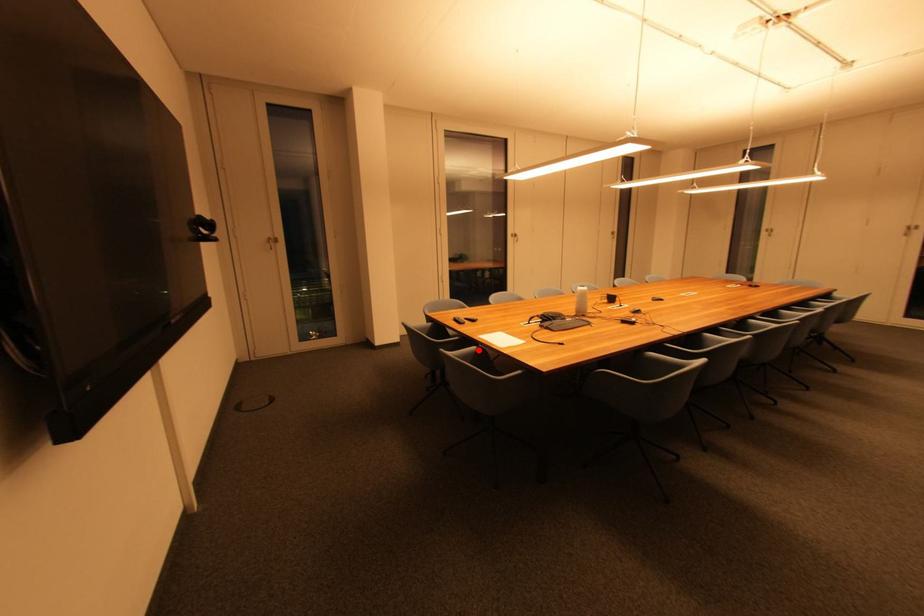
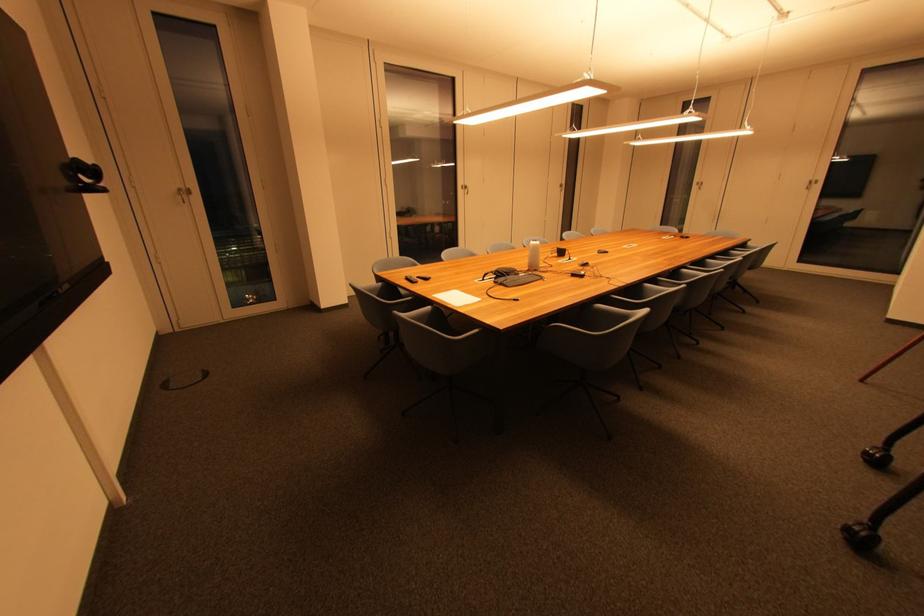
Question: I am providing you with two images of the same scene from different viewpoints. A red point is marked on the first image. Can you still see the location of the red point in image 2?

Choices:
 (A) Yes
 (B) No

Answer: (A)